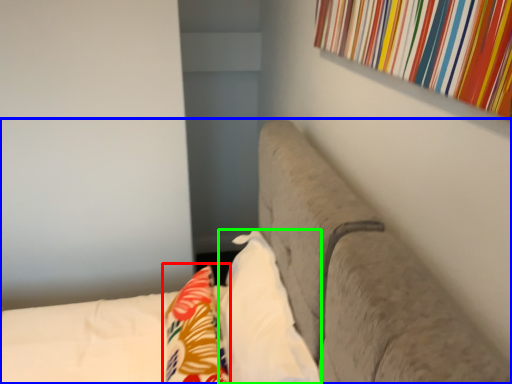
Question: Estimate the real-world distances between objects in this image. Which object is farther from throw pillow (highlighted by a red box), furniture (highlighted by a blue box) or pillow (highlighted by a green box)?

Choices:
 (A) furniture
 (B) pillow

Answer: (A)